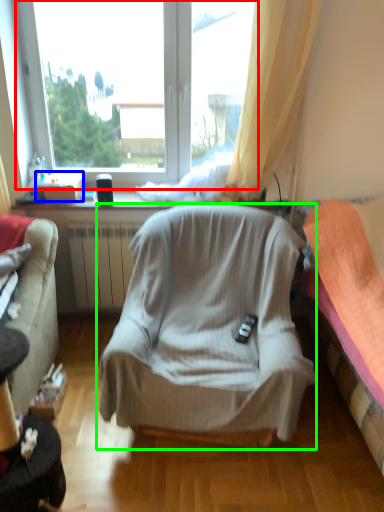
Question: Which object is the closest to the window (highlighted by a red box)? Choose among these: box (highlighted by a blue box) or chair (highlighted by a green box).

Choices:
 (A) box
 (B) chair

Answer: (A)